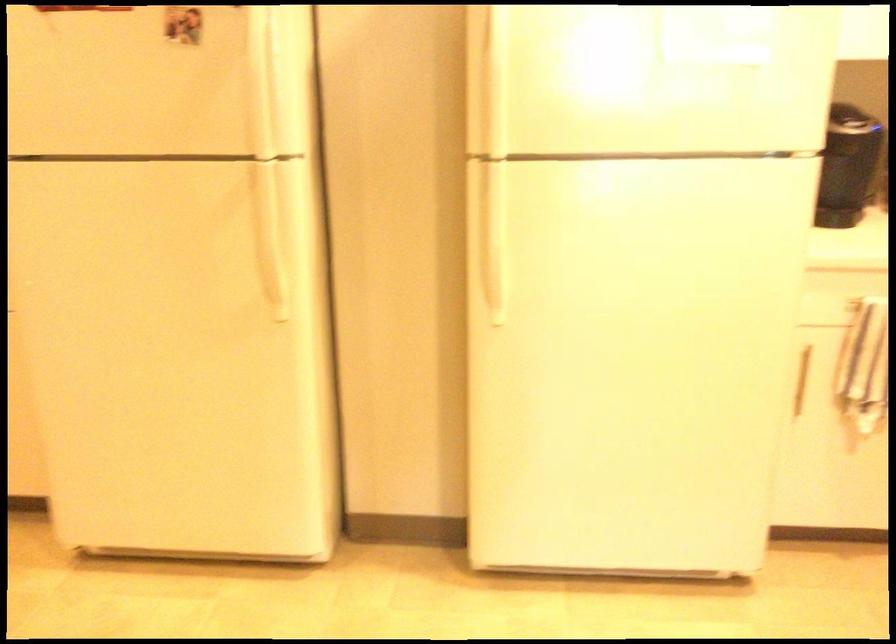
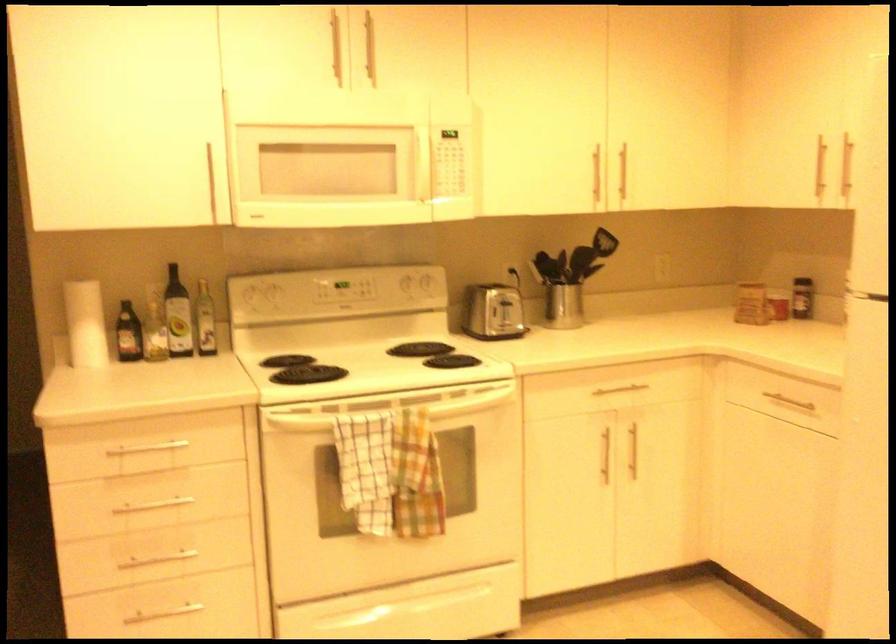
Question: The camera is either moving clockwise (left) or counter-clockwise (right) around the object. The first image is from the beginning of the video and the second image is from the end. Is the camera moving left or right when shooting the video?

Choices:
 (A) Left
 (B) Right

Answer: (B)